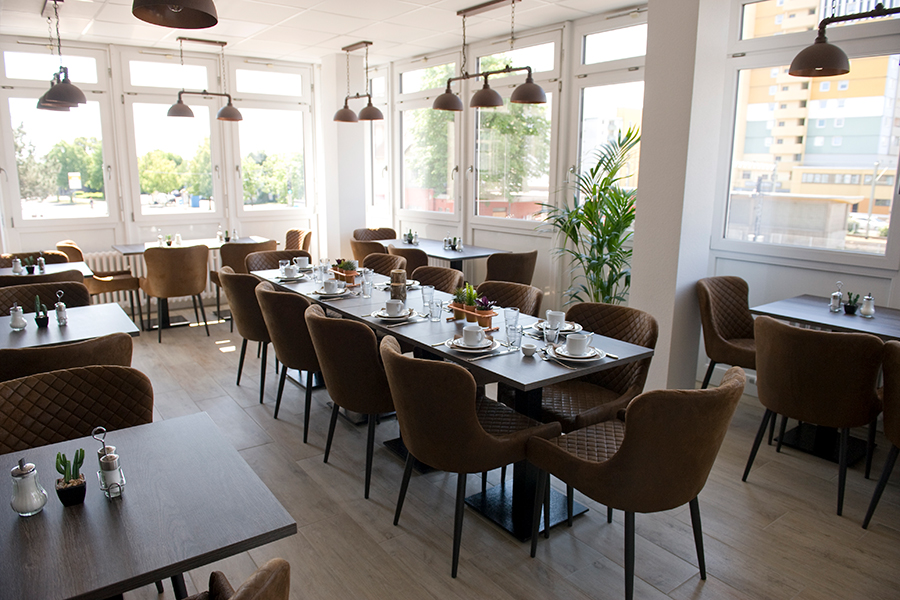
Find the location of a particular element. white saucers is located at coordinates (592, 354), (572, 325), (483, 344), (401, 312), (338, 289), (299, 274), (307, 265), (409, 281), (361, 269).